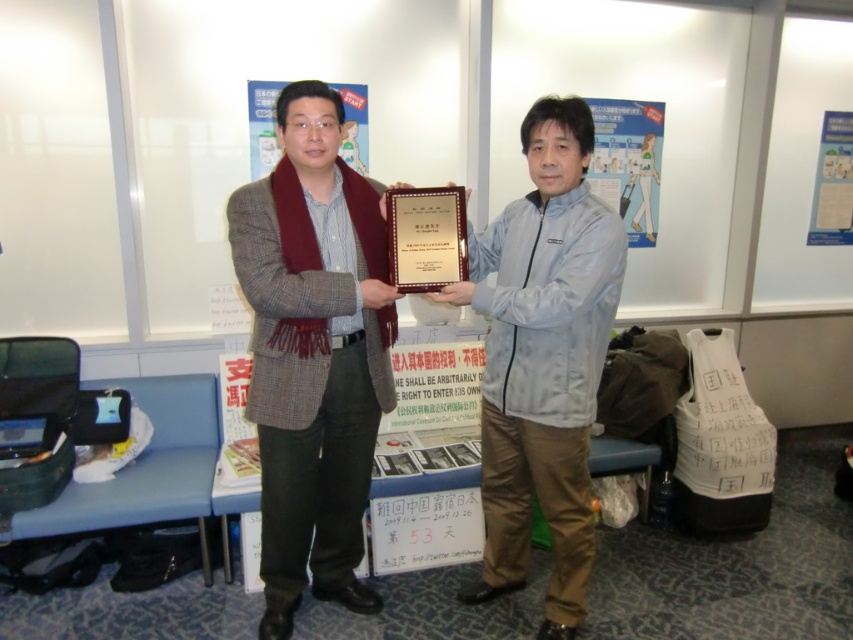
Consider the image. Does plaid wool coat at center come in front of light blue fabric jacket at center?

Yes, plaid wool coat at center is in front of light blue fabric jacket at center.

Is point (318, 179) more distant than point (554, 177)?

Yes, it is.

This screenshot has width=853, height=640. What are the coordinates of `plaid wool coat at center` in the screenshot? It's located at (312, 353).

Does light blue fabric jacket at center have a lesser height compared to matte gold plaque at center?

In fact, light blue fabric jacket at center may be taller than matte gold plaque at center.

The image size is (853, 640). Find the location of `light blue fabric jacket at center`. light blue fabric jacket at center is located at coordinates pos(543,358).

Can you confirm if plaid wool coat at center is positioned to the right of matte gold plaque at center?

No, plaid wool coat at center is not to the right of matte gold plaque at center.

How distant is plaid wool coat at center from matte gold plaque at center?

The distance of plaid wool coat at center from matte gold plaque at center is 10.99 inches.

Which is behind, point (364, 440) or point (462, 268)?

The point (364, 440) is more distant.

Where is `plaid wool coat at center`? plaid wool coat at center is located at coordinates (312, 353).